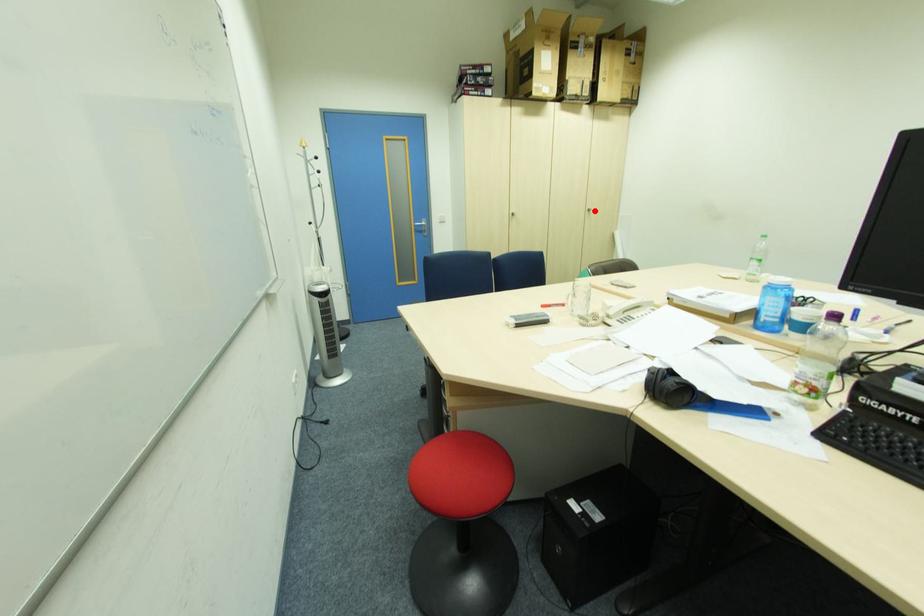
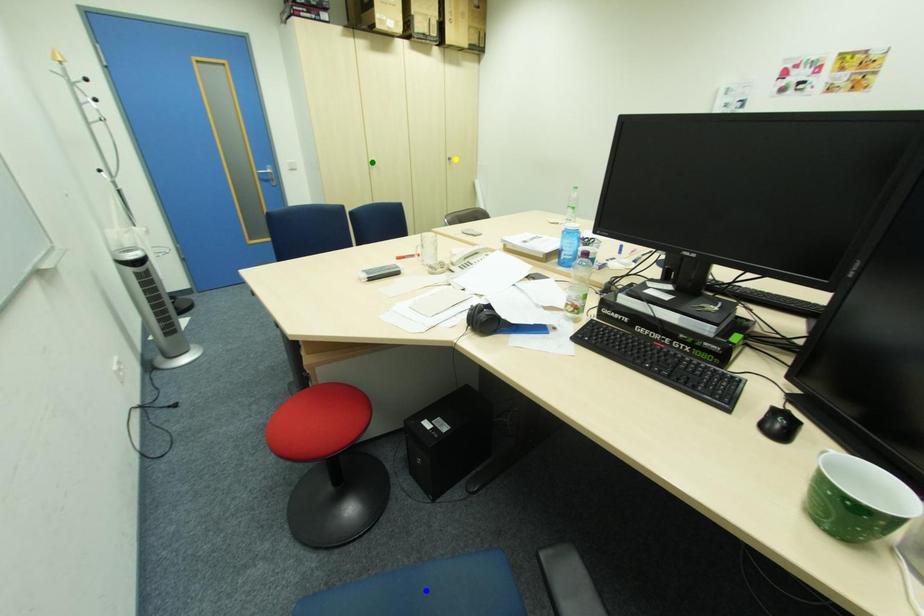
Question: I am providing you with two images of the same scene from different viewpoints. A red point is marked on the first image. You are given multiple points on the second image. Which point in image 2 is actually the same real-world point as the red point in image 1?

Choices:
 (A) yellow point
 (B) blue point
 (C) green point

Answer: (A)